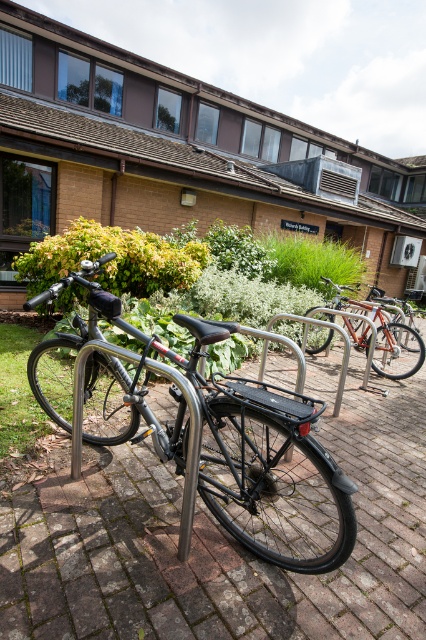
You are a delivery person trying to park your bike between the shiny black bicycle at center and the orange metallic bicycle at center. The space between them is 12.28 feet. If your bike is 5 feet wide, can you fit your bike in that space?

Answer: The space between the shiny black bicycle at center and the orange metallic bicycle at center is 12.28 feet. Since your bike is only 5 feet wide, there is more than enough space to park your bike between them.

You are standing on the paved area in front of the Richard Building. You want to check if you can reach the shiny black bicycle at center without moving more than 6 feet. Can you reach it?

The shiny black bicycle at center and viewer are 5.91 feet apart from each other. Since 5.91 feet is less than 6 feet, you can reach the shiny black bicycle at center without moving more than 6 feet.